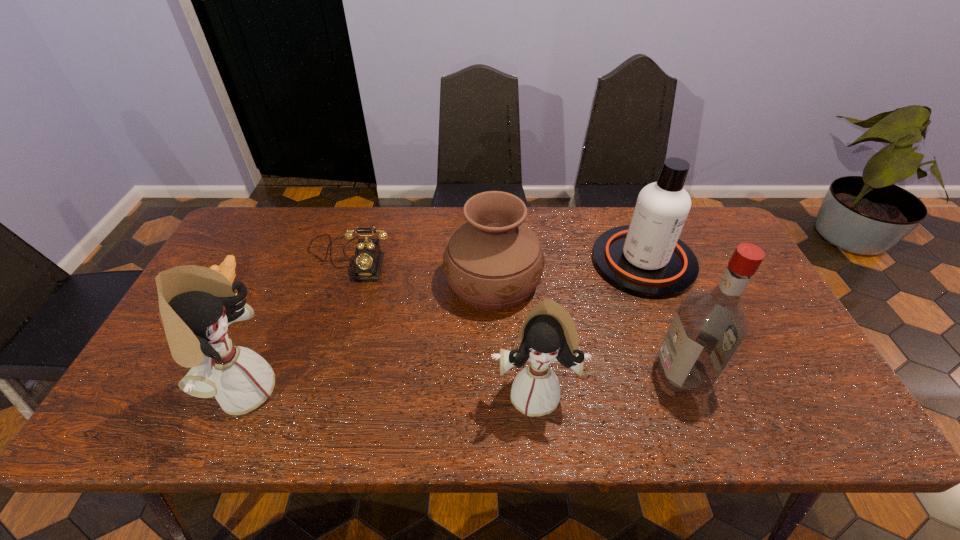
I want to click on free spot that satisfies the following two spatial constraints: 1. on the back side of the fifth tallest object; 2. on the left side of the cleansing agent, so click(492, 262).

The width and height of the screenshot is (960, 540). In order to click on free space that satisfies the following two spatial constraints: 1. on the dial of the cleansing agent; 2. on the left side of the telephone in this screenshot , I will do `click(348, 262)`.

Locate an element on the screen. Image resolution: width=960 pixels, height=540 pixels. vacant area in the image that satisfies the following two spatial constraints: 1. on the front side of the cleansing agent; 2. at the front face of the left doll is located at coordinates (692, 390).